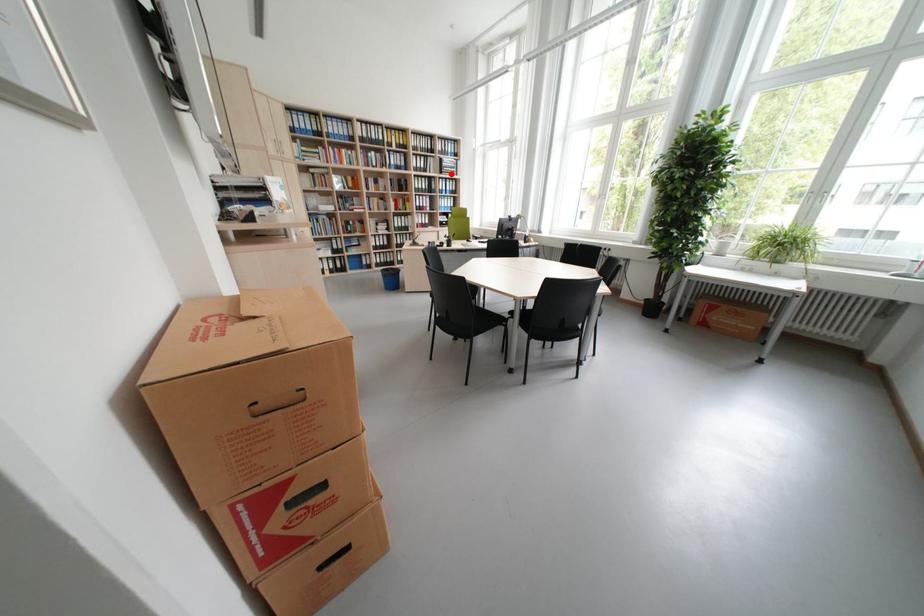
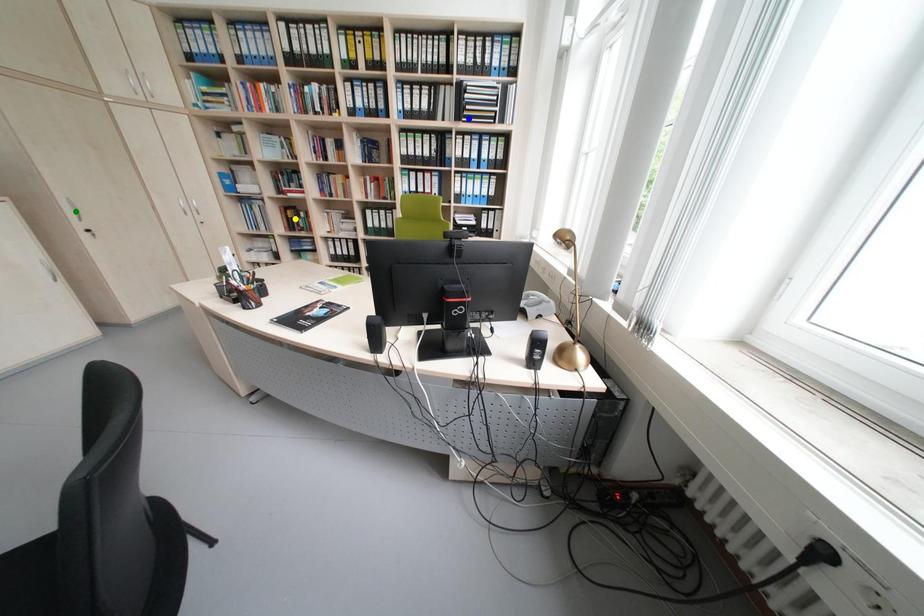
Question: I am providing you with two images of the same scene from different viewpoints. A red point is marked on the first image. You are given multiple points on the second image. In image 2, which mark is for the same physical point as the one in image 1?

Choices:
 (A) green point
 (B) blue point
 (C) yellow point

Answer: (B)